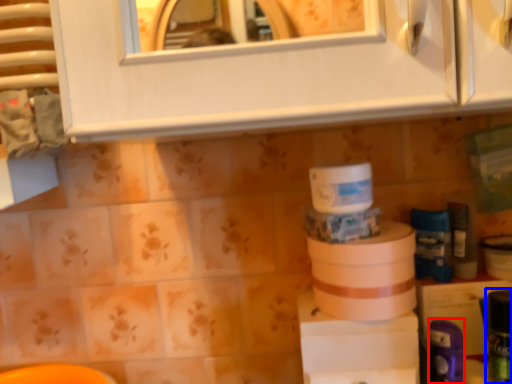
Question: Which of the following is the closest to the observer, toiletry (highlighted by a red box) or toiletry (highlighted by a blue box)?

Choices:
 (A) toiletry
 (B) toiletry

Answer: (B)